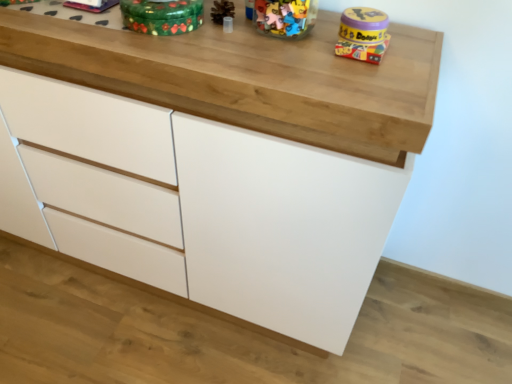
At what (x,y) coordinates should I click in order to perform the action: click on free space in front of green painted wood toy at upper center, acting as the 2th toy starting from the right. Please return your answer as a coordinate pair (x, y). The height and width of the screenshot is (384, 512). Looking at the image, I should click on [x=161, y=53].